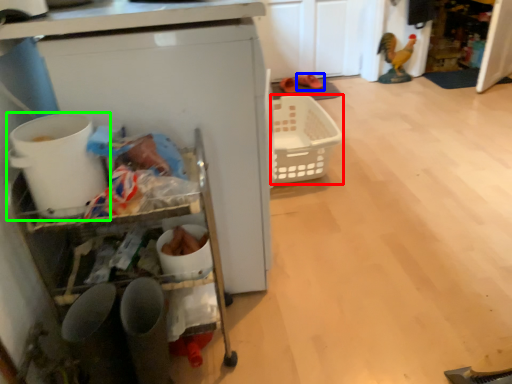
Question: Estimate the real-world distances between objects in this image. Which object is closer to basket (highlighted by a red box), footwear (highlighted by a blue box) or appliance (highlighted by a green box)?

Choices:
 (A) footwear
 (B) appliance

Answer: (A)